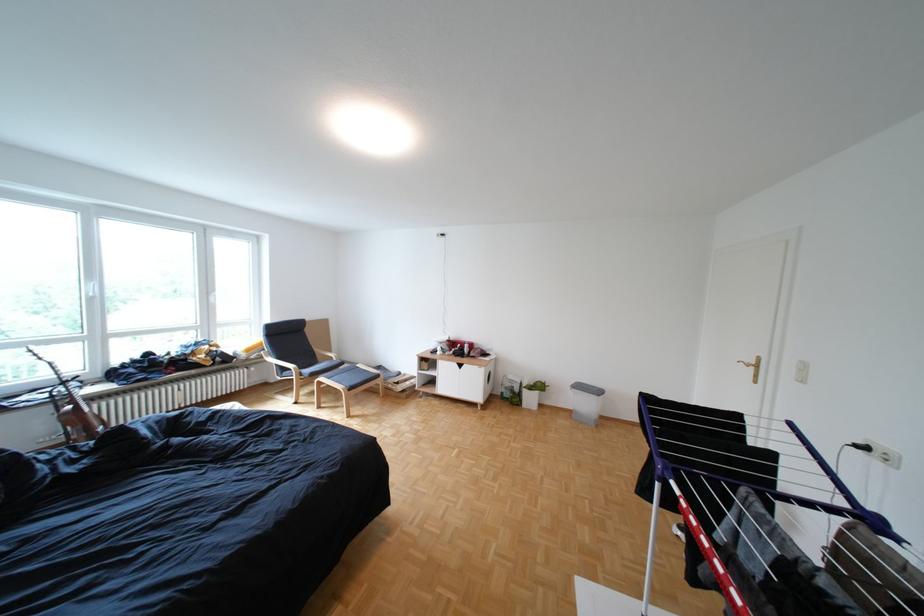
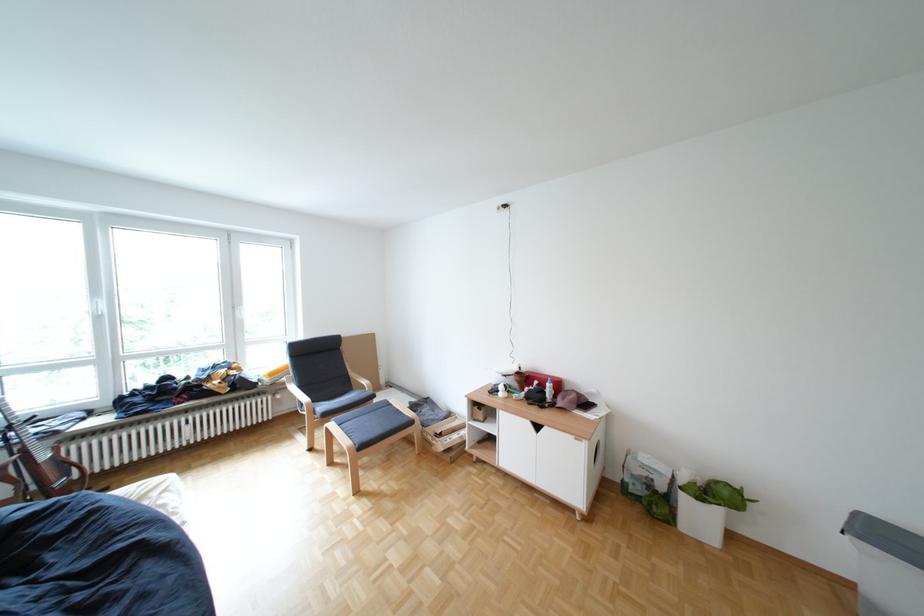
Where in the second image is the point corresponding to point (475, 346) from the first image?

(552, 383)